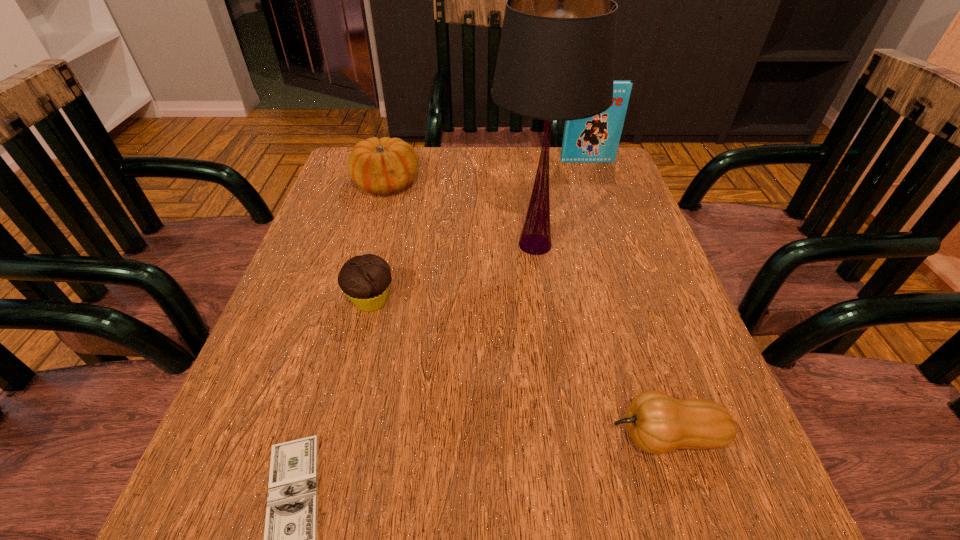
This screenshot has height=540, width=960. What are the coordinates of `vacant space located 0.190m on the front cover of the farthest object` in the screenshot? It's located at 602,204.

Where is `free space located 0.060m on the back of the taller gourd`? free space located 0.060m on the back of the taller gourd is located at coordinates (395, 156).

You are a GUI agent. You are given a task and a screenshot of the screen. Output one action in this format:
    pyautogui.click(x=<x>, y=<y>)
    Task: Click on the free space located 0.190m on the back of the muffin
    This screenshot has width=960, height=540.
    Given the screenshot: What is the action you would take?
    pyautogui.click(x=390, y=222)

The width and height of the screenshot is (960, 540). I want to click on free space located 0.330m on the stem side of the shorter gourd, so click(x=375, y=436).

The height and width of the screenshot is (540, 960). I want to click on vacant region located on the stem side of the shorter gourd, so click(418, 436).

Image resolution: width=960 pixels, height=540 pixels. Identify the location of free space located 0.230m on the stem side of the shorter gourd. (446, 436).

You are a GUI agent. You are given a task and a screenshot of the screen. Output one action in this format:
    pyautogui.click(x=<x>, y=<y>)
    Task: Click on the book at the far edge
    
    Given the screenshot: What is the action you would take?
    pyautogui.click(x=595, y=139)

Image resolution: width=960 pixels, height=540 pixels. What are the coordinates of `gourd that is positioned at the far edge` in the screenshot? It's located at (382, 166).

Where is `gourd that is positioned at the left edge`? gourd that is positioned at the left edge is located at coordinates (382, 166).

Locate an element on the screen. muffin present at the left edge is located at coordinates (366, 279).